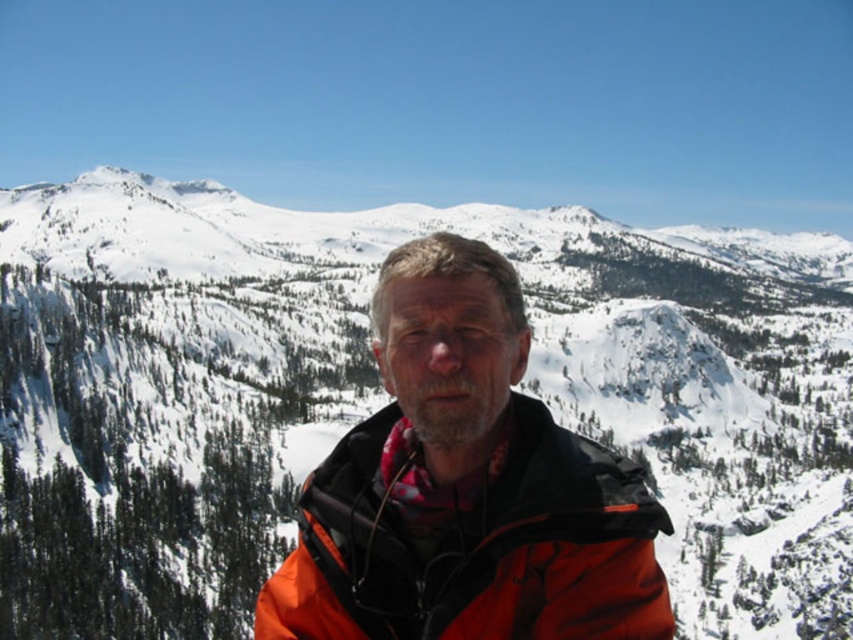
Measure the distance between snowy mountain at center and orange softshell jacket at center.

snowy mountain at center is 629.66 feet away from orange softshell jacket at center.

Is the position of snowy mountain at center more distant than that of orange softshell jacket at center?

That is True.

What do you see at coordinates (383, 397) in the screenshot? The image size is (853, 640). I see `snowy mountain at center` at bounding box center [383, 397].

This screenshot has height=640, width=853. I want to click on snowy mountain at center, so click(x=383, y=397).